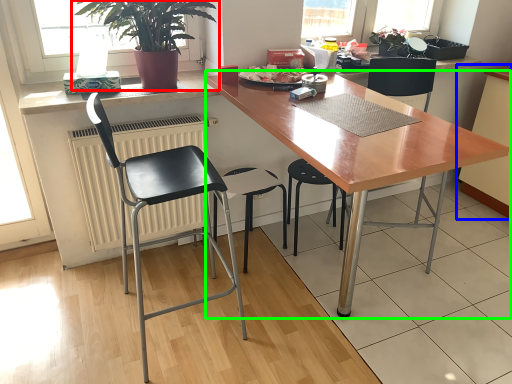
Question: Estimate the real-world distances between objects in this image. Which object is closer to houseplant (highlighted by a red box), cabinetry (highlighted by a blue box) or desk (highlighted by a green box)?

Choices:
 (A) cabinetry
 (B) desk

Answer: (B)